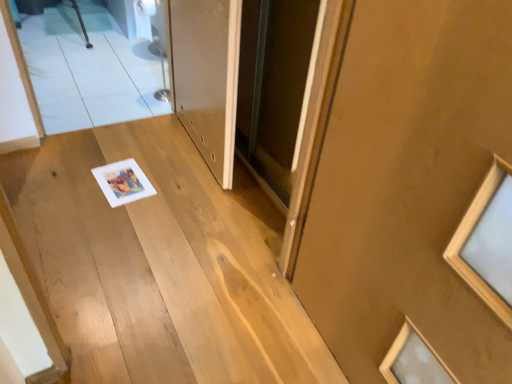
Identify the location of vacant space in matte brown door at center, which is the first door in right-to-left order (from a real-world perspective). (313, 338).